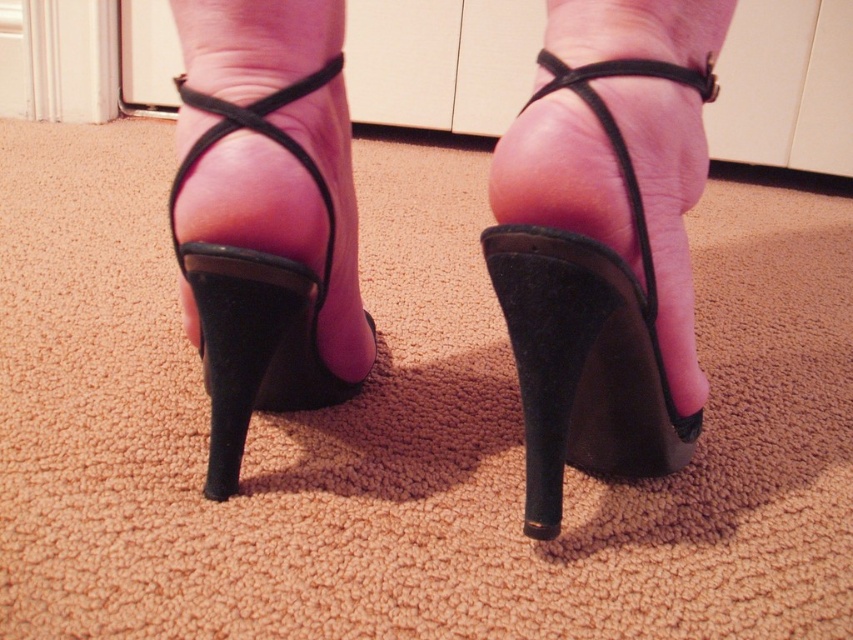
You are a shoe designer comparing two heels in the image. Which one is taller between the black leather high heels at center and the black suede heel at lower center?

The black leather high heels at center are taller than the black suede heel at lower center.

You are standing in a room and see two points marked on the carpet. The points are labeled as point (283, 376) and point (556, 522). Which point is closer to you?

Point (283, 376) is closer to you because it is further to the viewer than point (556, 522).

You are standing in a room and notice two pairs of shoes at the center of the carpet. The black leather high heels at center and the matte black sandal at center. Which pair is closer to you?

The black leather high heels at center is closer to you because it is in front of the matte black sandal at center.